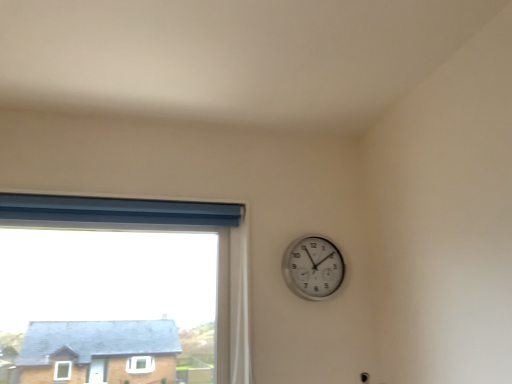
Question: Is silver metallic wall clock at upper right positioned beyond the bounds of blue fabric window at upper left?

Choices:
 (A) no
 (B) yes

Answer: (B)

Question: Considering the relative sizes of silver metallic wall clock at upper right and blue fabric window at upper left in the image provided, is silver metallic wall clock at upper right shorter than blue fabric window at upper left?

Choices:
 (A) no
 (B) yes

Answer: (B)

Question: Is silver metallic wall clock at upper right to the right of blue fabric window at upper left from the viewer's perspective?

Choices:
 (A) no
 (B) yes

Answer: (B)

Question: From a real-world perspective, is silver metallic wall clock at upper right located beneath blue fabric window at upper left?

Choices:
 (A) yes
 (B) no

Answer: (B)

Question: Can you confirm if silver metallic wall clock at upper right is bigger than blue fabric window at upper left?

Choices:
 (A) yes
 (B) no

Answer: (B)

Question: Considering the relative sizes of silver metallic wall clock at upper right and blue fabric window at upper left in the image provided, is silver metallic wall clock at upper right taller than blue fabric window at upper left?

Choices:
 (A) no
 (B) yes

Answer: (A)

Question: Considering the relative sizes of blue fabric window at upper left and silver metallic wall clock at upper right in the image provided, is blue fabric window at upper left smaller than silver metallic wall clock at upper right?

Choices:
 (A) no
 (B) yes

Answer: (A)

Question: Considering the relative sizes of blue fabric window at upper left and silver metallic wall clock at upper right in the image provided, is blue fabric window at upper left wider than silver metallic wall clock at upper right?

Choices:
 (A) yes
 (B) no

Answer: (A)

Question: Is the surface of blue fabric window at upper left in direct contact with silver metallic wall clock at upper right?

Choices:
 (A) no
 (B) yes

Answer: (A)

Question: Is blue fabric window at upper left further to camera compared to silver metallic wall clock at upper right?

Choices:
 (A) no
 (B) yes

Answer: (A)

Question: Considering the relative sizes of blue fabric window at upper left and silver metallic wall clock at upper right in the image provided, is blue fabric window at upper left shorter than silver metallic wall clock at upper right?

Choices:
 (A) yes
 (B) no

Answer: (B)

Question: Is blue fabric window at upper left facing towards silver metallic wall clock at upper right?

Choices:
 (A) yes
 (B) no

Answer: (B)

Question: Would you say blue fabric window at upper left is to the left or to the right of silver metallic wall clock at upper right in the picture?

Choices:
 (A) right
 (B) left

Answer: (B)